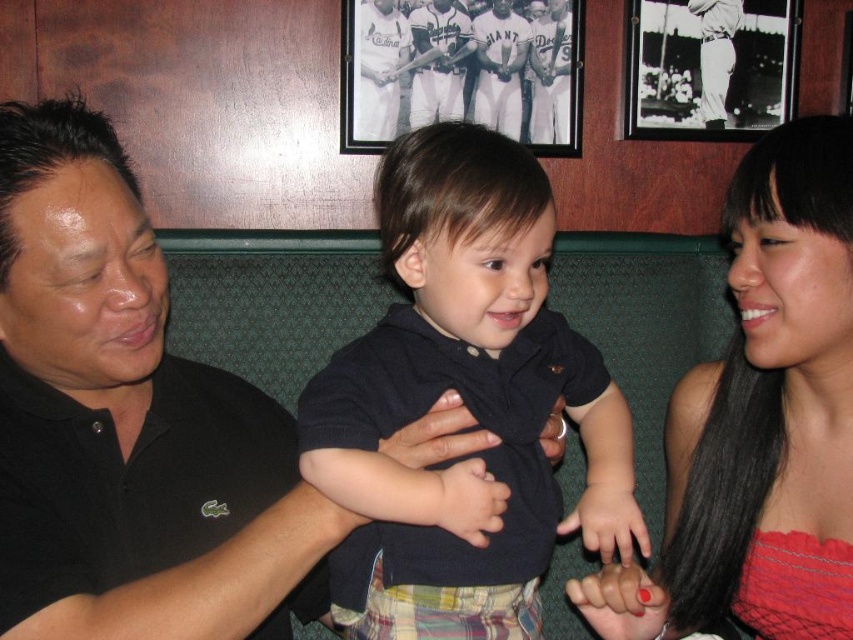
Does white cotton baseball uniform at center appear on the left side of white baseball uniform at upper center?

Correct, you'll find white cotton baseball uniform at center to the left of white baseball uniform at upper center.

Between point (521, 70) and point (732, 16), which one is positioned behind?

Positioned behind is point (732, 16).

Which is in front, point (515, 140) or point (724, 90)?

Point (515, 140) is more forward.

You are a GUI agent. You are given a task and a screenshot of the screen. Output one action in this format:
    pyautogui.click(x=<x>, y=<y>)
    Task: Click on the white cotton baseball uniform at center
    The image size is (853, 640).
    Given the screenshot: What is the action you would take?
    pyautogui.click(x=498, y=67)

Between point (366, 56) and point (553, 60), which one is positioned behind?

The point (553, 60) is behind.

Is white jersey at upper center to the right of white jersey at center from the viewer's perspective?

Incorrect, white jersey at upper center is not on the right side of white jersey at center.

Image resolution: width=853 pixels, height=640 pixels. Describe the element at coordinates (378, 68) in the screenshot. I see `white jersey at upper center` at that location.

Find the location of a particular element. This screenshot has height=640, width=853. white jersey at upper center is located at coordinates (378, 68).

Is dark blue cotton shirt at center below white cotton baseball uniform at center?

Yes, dark blue cotton shirt at center is below white cotton baseball uniform at center.

Which is behind, point (485, 611) or point (492, 38)?

The point (492, 38) is more distant.

Does point (409, 333) come closer to viewer compared to point (503, 83)?

Yes, point (409, 333) is closer to viewer.

At what (x,y) coordinates should I click in order to perform the action: click on dark blue cotton shirt at center. Please return your answer as a coordinate pair (x, y). The width and height of the screenshot is (853, 640). Looking at the image, I should click on (463, 403).